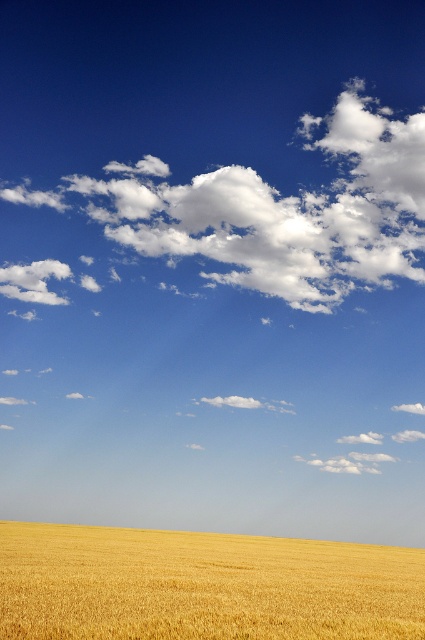
Between white fluffy cloud at upper center and golden matte wheat field at bottom, which one appears on the left side from the viewer's perspective?

golden matte wheat field at bottom is more to the left.

Does white fluffy cloud at upper center come in front of golden matte wheat field at bottom?

No, white fluffy cloud at upper center is behind golden matte wheat field at bottom.

Measure the distance between white fluffy cloud at upper center and camera.

They are 26.49 meters apart.

This screenshot has width=425, height=640. I want to click on white fluffy cloud at upper center, so click(277, 211).